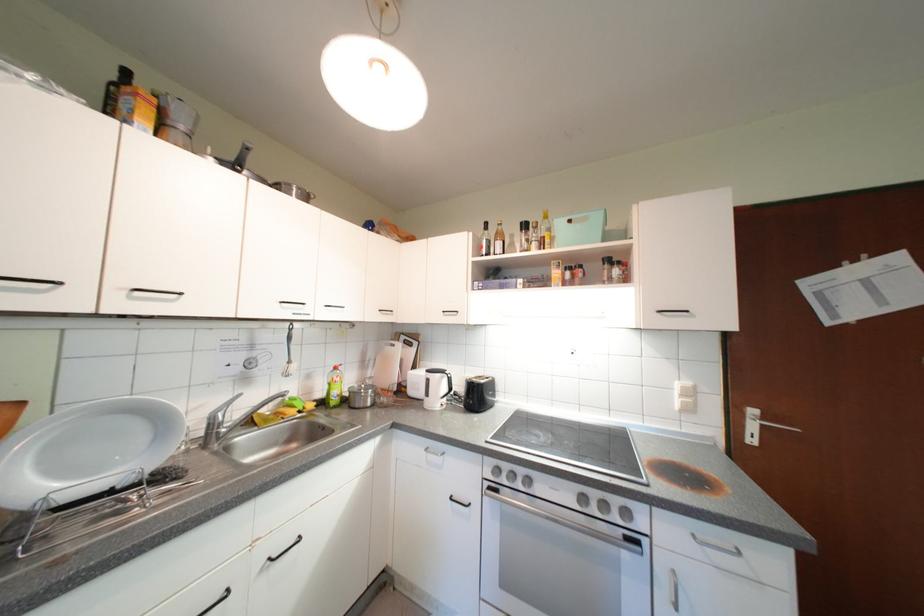
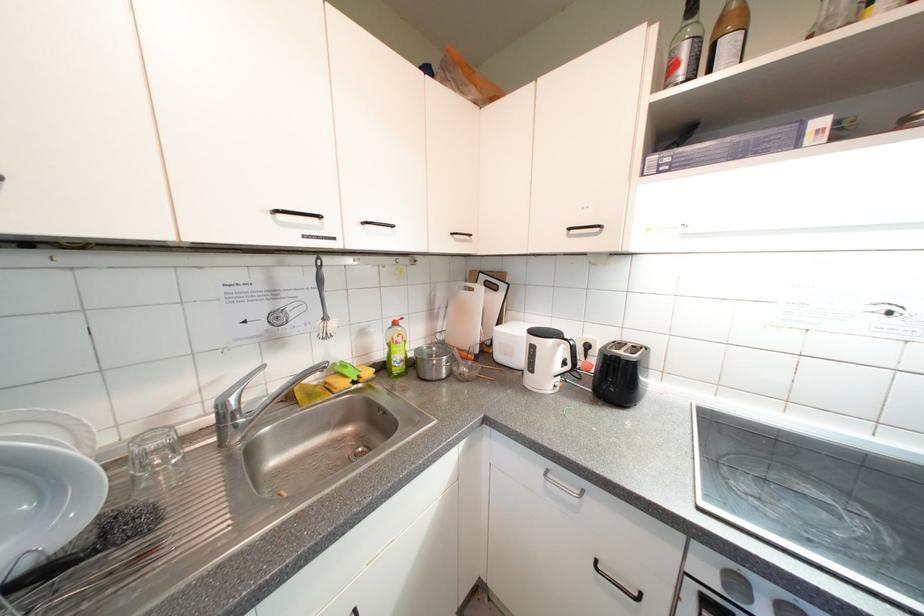
In the second image, find the point that corresponds to (x=505, y=472) in the first image.

(747, 586)